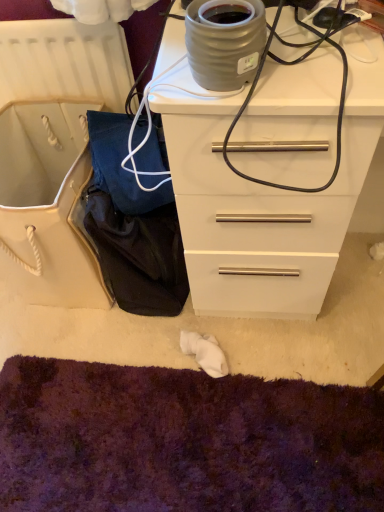
This screenshot has width=384, height=512. In order to click on empty space that is ontop of purple shaggy carpet at lower center (from a real-world perspective) in this screenshot , I will do `click(101, 438)`.